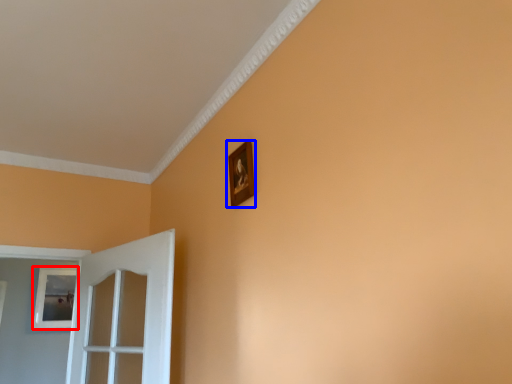
Question: Among these objects, which one is farthest to the camera, picture frame (highlighted by a red box) or picture frame (highlighted by a blue box)?

Choices:
 (A) picture frame
 (B) picture frame

Answer: (A)